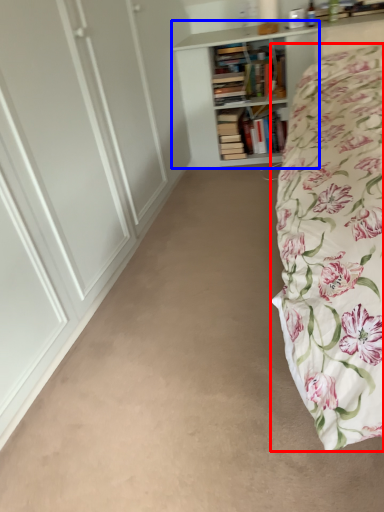
Question: Which object is further to the camera taking this photo, bed (highlighted by a red box) or bookcase (highlighted by a blue box)?

Choices:
 (A) bed
 (B) bookcase

Answer: (B)